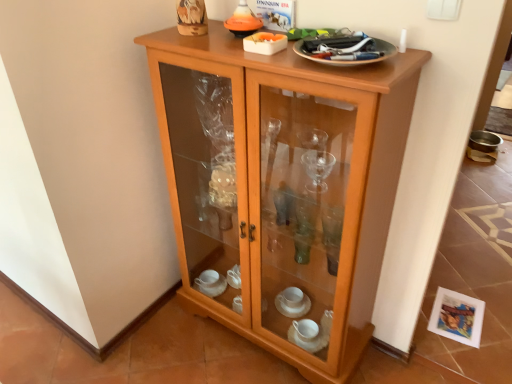
Question: Is light wood/glass cupboard at center positioned in front of metallic silver plate at upper right?

Choices:
 (A) yes
 (B) no

Answer: (A)

Question: Does light wood/glass cupboard at center have a smaller size compared to metallic silver plate at upper right?

Choices:
 (A) no
 (B) yes

Answer: (A)

Question: Considering the relative sizes of light wood/glass cupboard at center and metallic silver plate at upper right in the image provided, is light wood/glass cupboard at center thinner than metallic silver plate at upper right?

Choices:
 (A) no
 (B) yes

Answer: (A)

Question: Is light wood/glass cupboard at center oriented away from metallic silver plate at upper right?

Choices:
 (A) no
 (B) yes

Answer: (A)

Question: Considering the relative sizes of light wood/glass cupboard at center and metallic silver plate at upper right in the image provided, is light wood/glass cupboard at center shorter than metallic silver plate at upper right?

Choices:
 (A) no
 (B) yes

Answer: (A)

Question: Is light wood/glass cupboard at center far from metallic silver plate at upper right?

Choices:
 (A) no
 (B) yes

Answer: (A)

Question: Is the depth of metallic silver plate at upper right greater than that of light wood/glass cupboard at center?

Choices:
 (A) yes
 (B) no

Answer: (A)

Question: Does metallic silver plate at upper right have a lesser height compared to light wood/glass cupboard at center?

Choices:
 (A) yes
 (B) no

Answer: (A)

Question: Are metallic silver plate at upper right and light wood/glass cupboard at center beside each other?

Choices:
 (A) yes
 (B) no

Answer: (B)

Question: From the image's perspective, is metallic silver plate at upper right over light wood/glass cupboard at center?

Choices:
 (A) yes
 (B) no

Answer: (A)

Question: From a real-world perspective, is metallic silver plate at upper right located beneath light wood/glass cupboard at center?

Choices:
 (A) no
 (B) yes

Answer: (A)

Question: Is metallic silver plate at upper right facing away from light wood/glass cupboard at center?

Choices:
 (A) yes
 (B) no

Answer: (B)

Question: From the image's perspective, is metallic silver plate at upper right positioned above or below light wood/glass cupboard at center?

Choices:
 (A) below
 (B) above

Answer: (B)